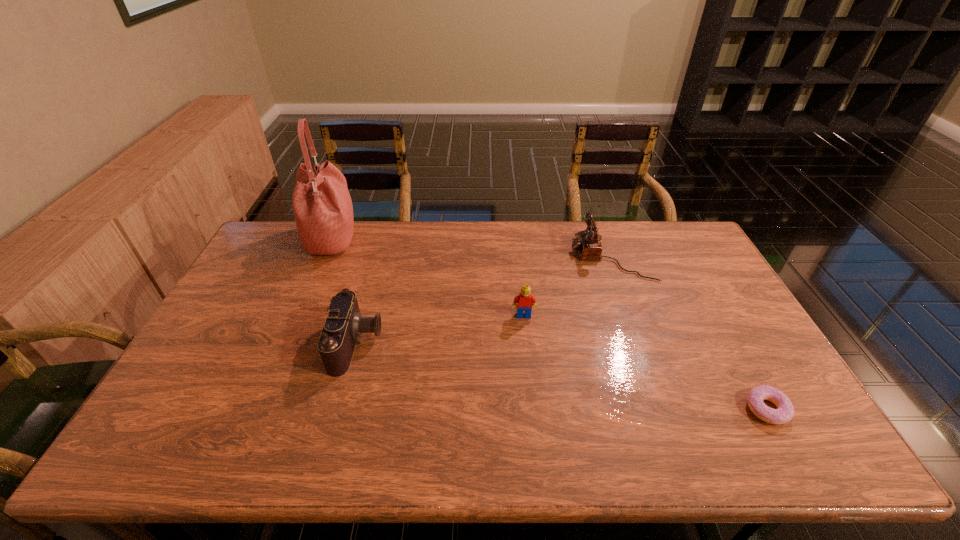
Identify the location of vacant space that satisfies the following two spatial constraints: 1. on the face of the shortest object; 2. on the left side of the third object from right to left. The image size is (960, 540). (533, 409).

I want to click on free space that satisfies the following two spatial constraints: 1. on the dial of the telephone; 2. on the face of the third object from right to left, so click(x=632, y=315).

What are the coordinates of `vacant region that satisfies the following two spatial constraints: 1. on the face of the Lego; 2. on the left side of the doughnut` in the screenshot? It's located at (533, 409).

Find the location of `free space that satisfies the following two spatial constraints: 1. on the face of the Lego; 2. on the front-facing side of the second object from left to right`. free space that satisfies the following two spatial constraints: 1. on the face of the Lego; 2. on the front-facing side of the second object from left to right is located at coordinates (526, 343).